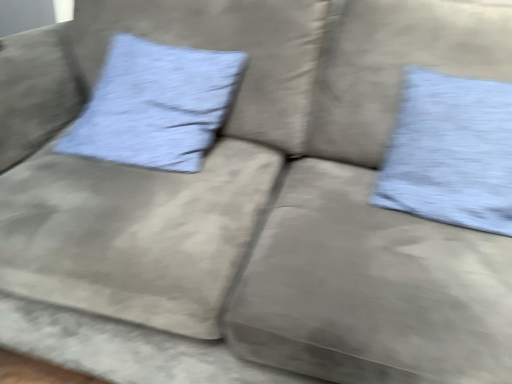
Question: From a real-world perspective, relative to light blue textured pillow at upper right, the 2th pillow when ordered from left to right, is blue textured pillow at upper left, the second pillow from the right, vertically above or below?

Choices:
 (A) below
 (B) above

Answer: (A)

Question: In the image, is blue textured pillow at upper left, the second pillow from the right, on the left side or the right side of light blue textured pillow at upper right, the 2th pillow when ordered from left to right?

Choices:
 (A) right
 (B) left

Answer: (B)

Question: Do you think blue textured pillow at upper left, the 1th pillow positioned from the left, is within light blue textured pillow at upper right, marked as the 1th pillow in a right-to-left arrangement, or outside of it?

Choices:
 (A) inside
 (B) outside

Answer: (B)

Question: Would you say light blue textured pillow at upper right, the 2th pillow when ordered from left to right, is inside or outside blue textured pillow at upper left, the 1th pillow positioned from the left?

Choices:
 (A) inside
 (B) outside

Answer: (B)

Question: From a real-world perspective, is light blue textured pillow at upper right, the 2th pillow when ordered from left to right, physically located above or below blue textured pillow at upper left, the second pillow from the right?

Choices:
 (A) above
 (B) below

Answer: (A)

Question: Is light blue textured pillow at upper right, the 2th pillow when ordered from left to right, taller or shorter than blue textured pillow at upper left, the 1th pillow positioned from the left?

Choices:
 (A) short
 (B) tall

Answer: (B)

Question: From the image's perspective, is light blue textured pillow at upper right, marked as the 1th pillow in a right-to-left arrangement, above or below blue textured pillow at upper left, the 1th pillow positioned from the left?

Choices:
 (A) below
 (B) above

Answer: (A)